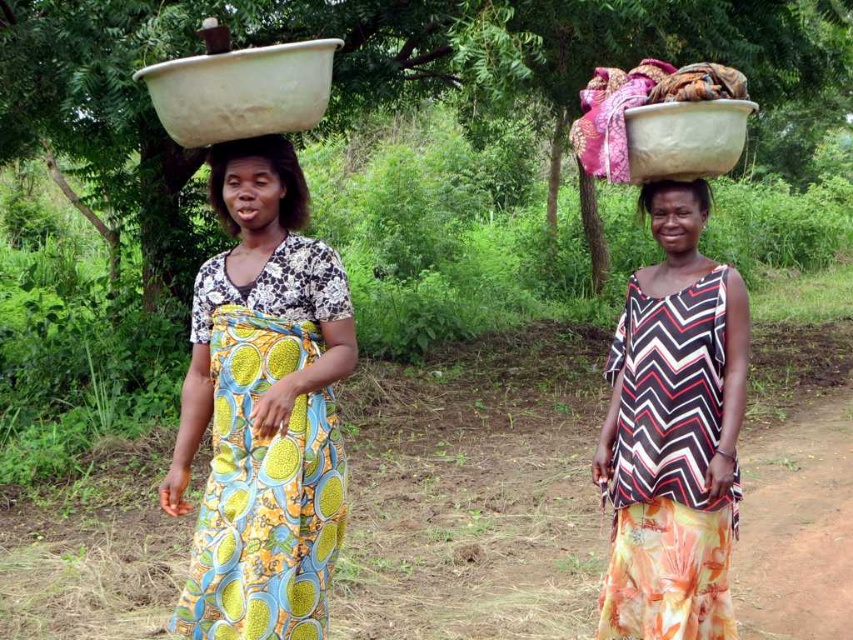
Can you confirm if brown soil at center is bigger than white matte bowl at upper right?

Actually, brown soil at center might be smaller than white matte bowl at upper right.

Does brown soil at center appear on the left side of white matte bowl at upper right?

Yes, brown soil at center is to the left of white matte bowl at upper right.

Does point (473, 609) come farther from viewer compared to point (633, 108)?

Yes, point (473, 609) is farther from viewer.

At what (x,y) coordinates should I click in order to perform the action: click on brown soil at center. Please return your answer as a coordinate pair (x, y). Looking at the image, I should click on (474, 493).

This screenshot has height=640, width=853. What do you see at coordinates (672, 433) in the screenshot?
I see `chevron-patterned fabric dress at center` at bounding box center [672, 433].

Between chevron-patterned fabric dress at center and matte plastic bowl at upper center, which one is positioned higher?

matte plastic bowl at upper center is higher up.

Measure the distance between chevron-patterned fabric dress at center and camera.

chevron-patterned fabric dress at center and camera are 8.69 feet apart from each other.

What are the coordinates of `chevron-patterned fabric dress at center` in the screenshot? It's located at (672, 433).

Is white matte bowl at upper right above matte black bowl at upper center?

Yes, white matte bowl at upper right is above matte black bowl at upper center.

Between white matte bowl at upper right and matte black bowl at upper center, which one has less height?

matte black bowl at upper center is shorter.

Where is `white matte bowl at upper right`? white matte bowl at upper right is located at coordinates (683, 138).

Locate an element on the screen. This screenshot has height=640, width=853. white matte bowl at upper right is located at coordinates (683, 138).